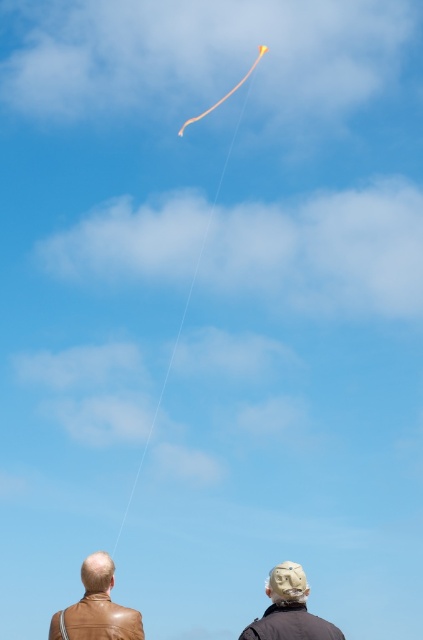
Looking at this image, can you confirm if brown leather jacket at lower left is shorter than orange string at upper center?

Indeed, brown leather jacket at lower left has a lesser height compared to orange string at upper center.

Is point (98, 616) positioned in front of point (255, 61)?

Yes, point (98, 616) is closer to viewer.

Image resolution: width=423 pixels, height=640 pixels. What do you see at coordinates (96, 608) in the screenshot?
I see `brown leather jacket at lower left` at bounding box center [96, 608].

Where is `brown leather jacket at lower left`? brown leather jacket at lower left is located at coordinates (96, 608).

Is matte black jacket at lower center thinner than orange string at upper center?

Yes, matte black jacket at lower center is thinner than orange string at upper center.

Is point (327, 636) farther from viewer compared to point (197, 275)?

No, it is not.

Identify the location of matte black jacket at lower center. (288, 609).

Can you confirm if matte black jacket at lower center is bigger than yellow matte kite at upper center?

No.

Does point (296, 625) come farther from viewer compared to point (180, 129)?

That is False.

Identify the location of matte black jacket at lower center. Image resolution: width=423 pixels, height=640 pixels. point(288,609).